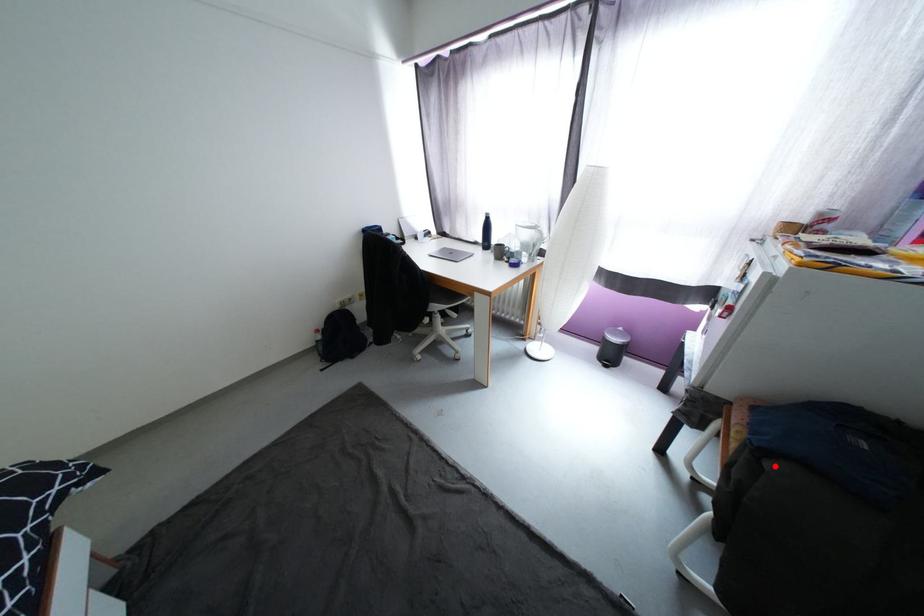
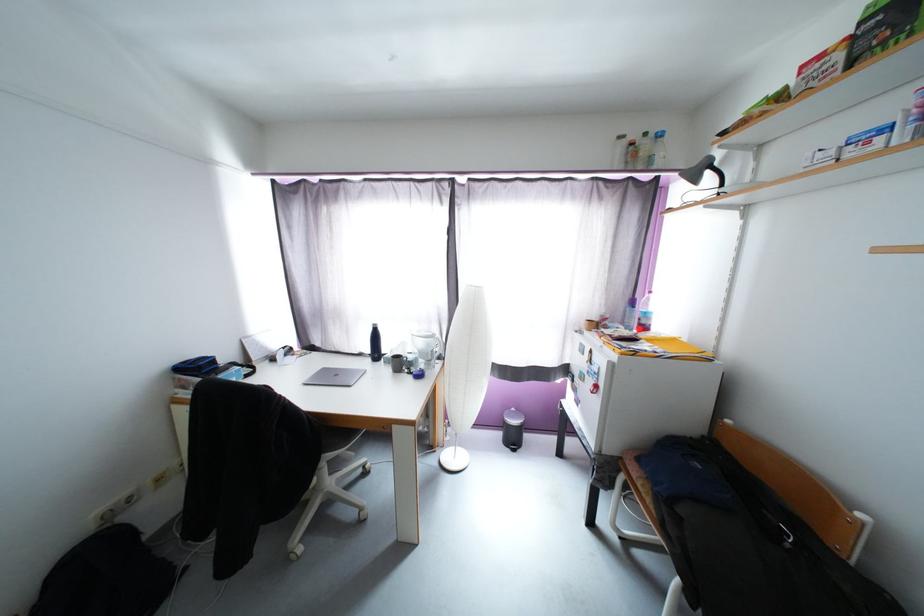
Where in the second image is the point corresponding to the highlighted location from the first image?

(687, 512)